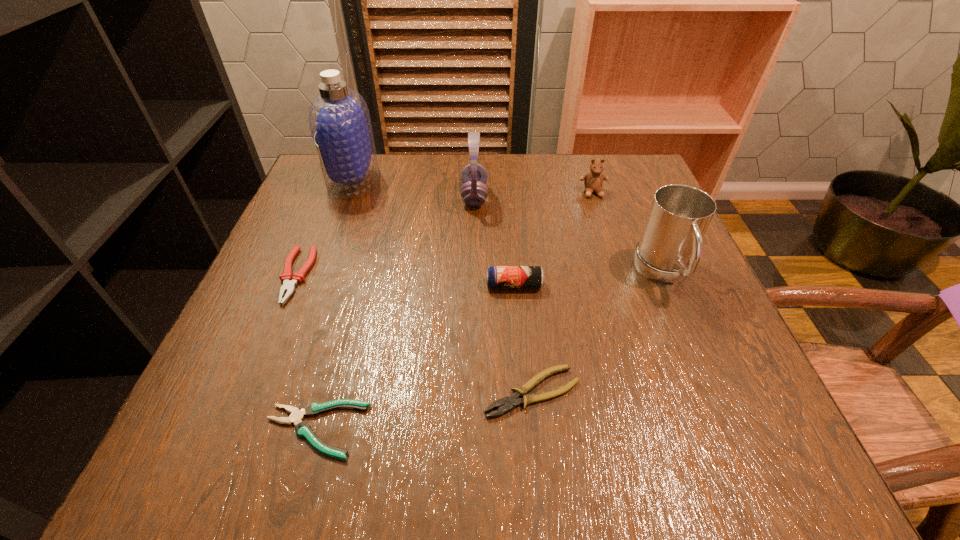
You are a GUI agent. You are given a task and a screenshot of the screen. Output one action in this format:
    pyautogui.click(x=<x>, y=<y>)
    Task: Click on the vacant area between the second shortest pliers and the mug
    
    Given the screenshot: What is the action you would take?
    pyautogui.click(x=598, y=333)

Locate an element on the screen. unoccupied area between the cleansing agent and the farthest pliers is located at coordinates (324, 228).

Where is `the closest object to the second pliers from right to left`? Image resolution: width=960 pixels, height=540 pixels. the closest object to the second pliers from right to left is located at coordinates (510, 402).

Locate an element on the screen. The width and height of the screenshot is (960, 540). object that stands as the fifth closest to the cleansing agent is located at coordinates (303, 429).

What are the coordinates of `pliers that is the closest to the beer can` in the screenshot? It's located at (510, 402).

Locate which pliers ranks in proximity to the tallest pliers. Please provide its 2D coordinates. Your answer should be formatted as a tuple, i.e. [(x, y)], where the tuple contains the x and y coordinates of a point satisfying the conditions above.

[(303, 429)]

I want to click on vacant space that satisfies the following two spatial constraints: 1. on the front side of the seventh tallest object; 2. on the right side of the cleansing agent, so click(276, 392).